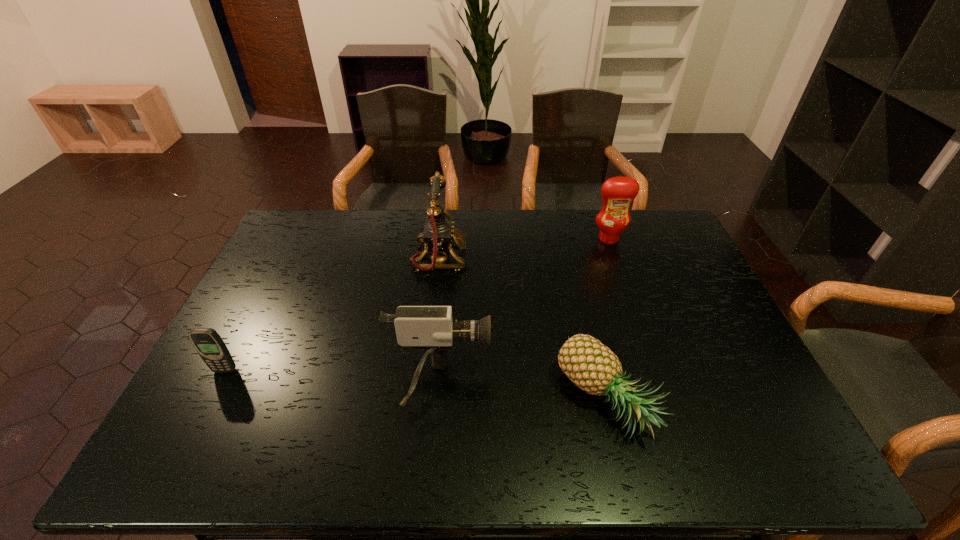
You are a GUI agent. You are given a task and a screenshot of the screen. Output one action in this format:
    pyautogui.click(x=<x>, y=<y>)
    Task: Click on the telephone
    
    Given the screenshot: What is the action you would take?
    pyautogui.click(x=438, y=234)

This screenshot has height=540, width=960. Find the location of `condiment`. condiment is located at coordinates (618, 193).

At what (x,y) coordinates should I click in order to perform the action: click on the third tallest object. Please return your answer as a coordinate pair (x, y). Looking at the image, I should click on (426, 328).

At what (x,y) coordinates should I click in order to perform the action: click on cellular telephone. Please return your answer as a coordinate pair (x, y). This screenshot has height=540, width=960. Looking at the image, I should click on (207, 342).

Identify the location of pineapple. This screenshot has height=540, width=960. (593, 367).

Identify the location of vacant space located on the front of the telephone, featuring the rotary dial. This screenshot has height=540, width=960. (578, 258).

Where is `vacant position located 0.320m on the label side of the condiment`? This screenshot has width=960, height=540. vacant position located 0.320m on the label side of the condiment is located at coordinates (635, 311).

Locate an element on the screen. This screenshot has height=540, width=960. vacant space located on the recording direction of the third shortest object is located at coordinates (639, 384).

Locate an element on the screen. The image size is (960, 540). vacant space located 0.110m on the screen of the cellular telephone is located at coordinates (204, 411).

You are a GUI agent. You are given a task and a screenshot of the screen. Output one action in this format:
    pyautogui.click(x=<x>, y=<y>)
    Task: Click on the free space located 0.060m on the right of the pineapple
    The height and width of the screenshot is (540, 960).
    Given the screenshot: What is the action you would take?
    pyautogui.click(x=679, y=400)